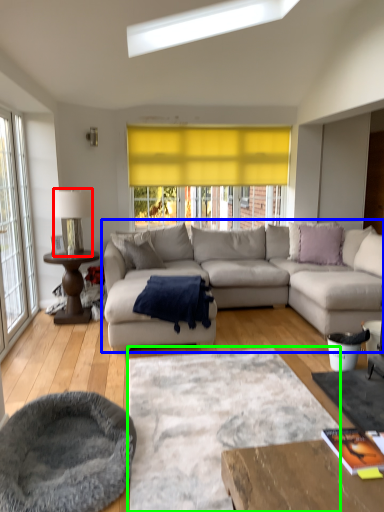
Question: Which object is the farthest from lamp (highlighted by a red box)? Choose among these: studio couch (highlighted by a blue box) or plain (highlighted by a green box).

Choices:
 (A) studio couch
 (B) plain

Answer: (B)